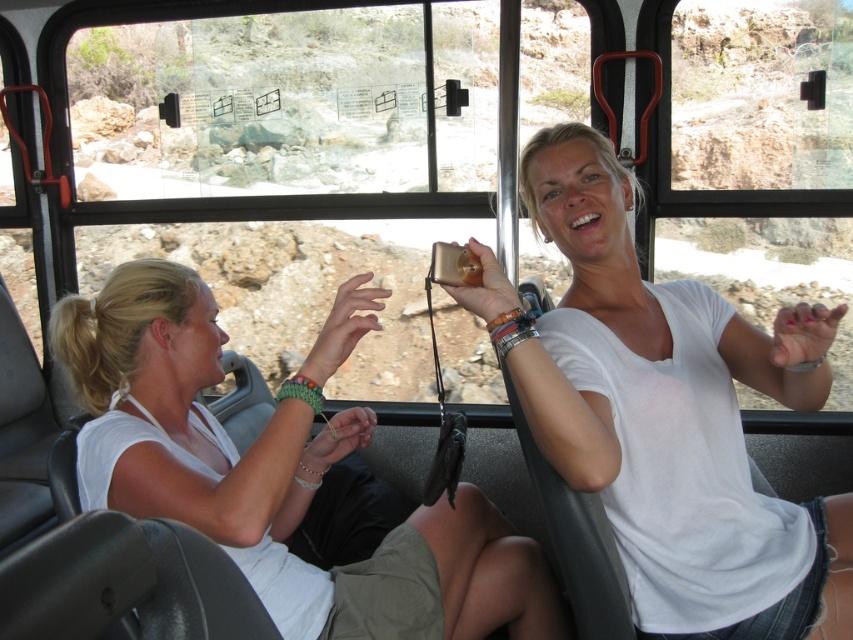
Question: Which of the following is the farthest from the observer?

Choices:
 (A) (209, 333)
 (B) (550, 154)

Answer: (A)

Question: Is white cotton shirt at center below white matte shirt at center?

Choices:
 (A) yes
 (B) no

Answer: (B)

Question: Which point appears closest to the camera in this image?

Choices:
 (A) (335, 330)
 (B) (722, 321)

Answer: (A)

Question: Which point is farther to the camera?

Choices:
 (A) (631, 442)
 (B) (369, 422)

Answer: (B)

Question: Is white cotton shirt at center to the left of white matte shirt at center from the viewer's perspective?

Choices:
 (A) yes
 (B) no

Answer: (B)

Question: Does white cotton shirt at center appear on the right side of white matte shirt at center?

Choices:
 (A) yes
 (B) no

Answer: (A)